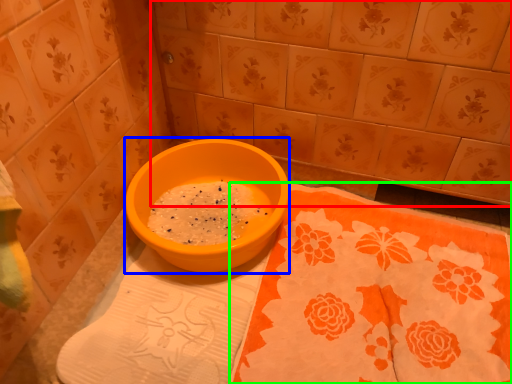
Question: Which is nearer to the ceramic tile (highlighted by a red box)? basin (highlighted by a blue box) or tablecloth (highlighted by a green box).

Choices:
 (A) basin
 (B) tablecloth

Answer: (A)